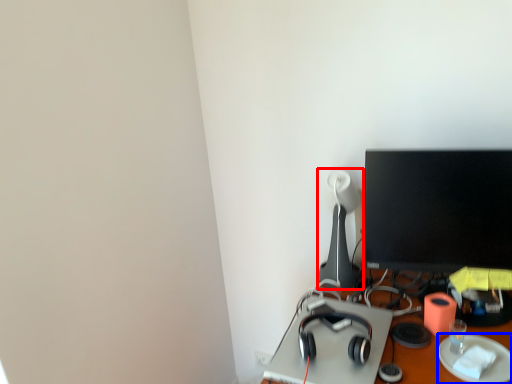
Question: Which object appears closest to the camera in this image, table lamp (highlighted by a red box) or paper plate (highlighted by a blue box)?

Choices:
 (A) table lamp
 (B) paper plate

Answer: (B)